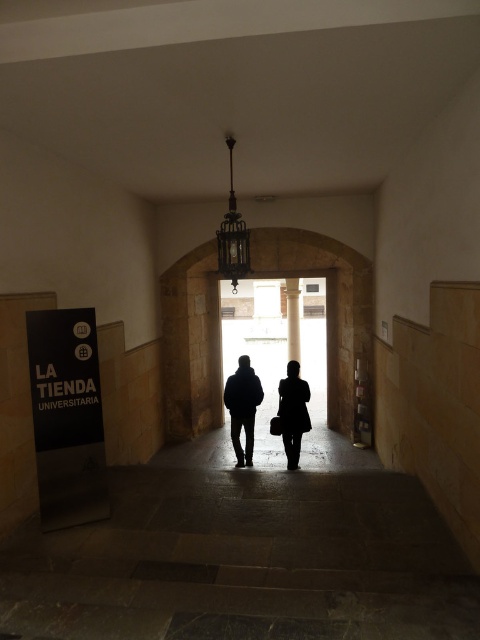
Question: Is dark blue jacket at center wider than smooth stone pillar at center?

Choices:
 (A) no
 (B) yes

Answer: (B)

Question: Which point is farther from the camera taking this photo?

Choices:
 (A) (299, 355)
 (B) (248, 394)
 (C) (292, 420)
 (D) (299, 368)

Answer: (A)

Question: Considering the relative positions of silhouette coat at center and smooth stone pillar at center in the image provided, where is silhouette coat at center located with respect to smooth stone pillar at center?

Choices:
 (A) right
 (B) left

Answer: (B)

Question: Can you confirm if black matte couple at center is smaller than smooth stone pillar at center?

Choices:
 (A) yes
 (B) no

Answer: (B)

Question: Which of the following is the closest to the observer?

Choices:
 (A) silhouette coat at center
 (B) dark blue jacket at center
 (C) smooth stone pillar at center
 (D) black matte couple at center

Answer: (A)

Question: Which object appears farthest from the camera in this image?

Choices:
 (A) dark blue jacket at center
 (B) silhouette coat at center

Answer: (A)